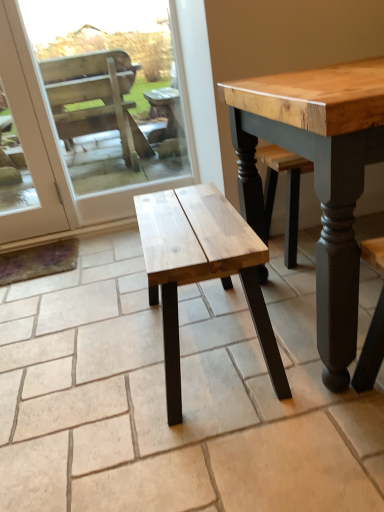
What do you see at coordinates (59, 148) in the screenshot? I see `wooden bench at lower center` at bounding box center [59, 148].

Locate an element on the screen. This screenshot has height=512, width=384. wooden bench at lower center is located at coordinates (59, 148).

This screenshot has height=512, width=384. In order to click on natural wood bench at center in this screenshot , I will do `click(201, 269)`.

This screenshot has height=512, width=384. What do you see at coordinates (201, 269) in the screenshot?
I see `natural wood bench at center` at bounding box center [201, 269].

The image size is (384, 512). Find the location of `wooden bench at lower center`. wooden bench at lower center is located at coordinates (59, 148).

Which is more to the left, wooden bench at lower center or natural wood bench at center?

wooden bench at lower center is more to the left.

Between wooden bench at lower center and natural wood bench at center, which one is positioned behind?

wooden bench at lower center is further from the camera.

Which is closer, (18, 38) or (164, 348)?

Clearly, point (18, 38) is more distant from the camera than point (164, 348).

From the image's perspective, would you say wooden bench at lower center is positioned over natural wood bench at center?

Correct, wooden bench at lower center appears higher than natural wood bench at center in the image.

From a real-world perspective, is wooden bench at lower center below natural wood bench at center?

No, from a real-world perspective, wooden bench at lower center is not beneath natural wood bench at center.

Based on the photo, considering the sizes of objects wooden bench at lower center and natural wood bench at center in the image provided, who is thinner, wooden bench at lower center or natural wood bench at center?

Thinner between the two is wooden bench at lower center.

Is wooden bench at lower center shorter than natural wood bench at center?

Incorrect, the height of wooden bench at lower center does not fall short of that of natural wood bench at center.

Between wooden bench at lower center and natural wood bench at center, which one has smaller size?

Smaller between the two is wooden bench at lower center.

Is wooden bench at lower center positioned beyond the bounds of natural wood bench at center?

That's correct, wooden bench at lower center is outside of natural wood bench at center.

Are wooden bench at lower center and natural wood bench at center making contact?

No, wooden bench at lower center is not making contact with natural wood bench at center.

Could you tell me if wooden bench at lower center is turned towards natural wood bench at center?

Yes, wooden bench at lower center is turned towards natural wood bench at center.

Measure the distance between wooden bench at lower center and natural wood bench at center.

A distance of 3.62 feet exists between wooden bench at lower center and natural wood bench at center.

Where is `stool on the right of the wooden bench at lower center`? stool on the right of the wooden bench at lower center is located at coordinates 201,269.

Considering the relative positions of natural wood bench at center and wooden bench at lower center in the image provided, is natural wood bench at center to the left or to the right of wooden bench at lower center?

From the image, it's evident that natural wood bench at center is to the right of wooden bench at lower center.

Is natural wood bench at center further to the viewer compared to wooden bench at lower center?

No, it is in front of wooden bench at lower center.

In the scene shown: Which is further, (159, 237) or (51, 170)?

The point (51, 170) is more distant.

From the image's perspective, which object appears higher, natural wood bench at center or wooden bench at lower center?

wooden bench at lower center is shown above in the image.

In the scene shown: From a real-world perspective, which object rests below the other?

In real-world perspective, natural wood bench at center is lower.

Looking at their sizes, would you say natural wood bench at center is wider or thinner than wooden bench at lower center?

In the image, natural wood bench at center appears to be wider than wooden bench at lower center.

Can you confirm if natural wood bench at center is shorter than wooden bench at lower center?

Yes.

Which of these two, natural wood bench at center or wooden bench at lower center, is bigger?

natural wood bench at center.

Could wooden bench at lower center be considered to be inside natural wood bench at center?

No, natural wood bench at center does not contain wooden bench at lower center.

Are natural wood bench at center and wooden bench at lower center far apart?

Yes, natural wood bench at center and wooden bench at lower center are quite far apart.

Is natural wood bench at center turned away from wooden bench at lower center?

That's not correct — natural wood bench at center is not looking away from wooden bench at lower center.

How many degrees apart are the facing directions of natural wood bench at center and wooden bench at lower center?

They differ by 90.5 degrees in their facing directions.

At what (x,y) coordinates should I click in order to perform the action: click on stool below the wooden bench at lower center (from the image's perspective). Please return your answer as a coordinate pair (x, y). This screenshot has height=512, width=384. Looking at the image, I should click on (201, 269).

At what (x,y) coordinates should I click in order to perform the action: click on stool below the wooden bench at lower center (from the image's perspective). Please return your answer as a coordinate pair (x, y). Looking at the image, I should click on (201, 269).

The width and height of the screenshot is (384, 512). What are the coordinates of `screen door positioned vertically above the natural wood bench at center (from a real-world perspective)` in the screenshot? It's located at (59, 148).